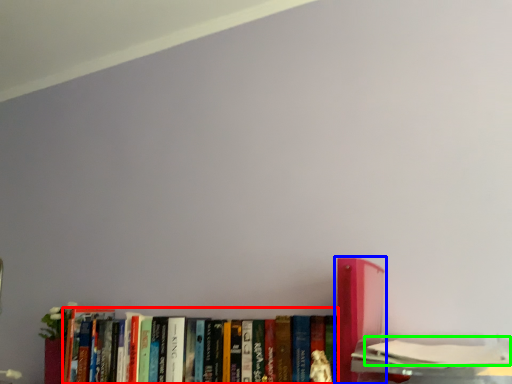
Question: Based on their relative distances, which object is nearer to book (highlighted by a red box)? Choose from book (highlighted by a blue box) and book (highlighted by a green box).

Choices:
 (A) book
 (B) book

Answer: (A)